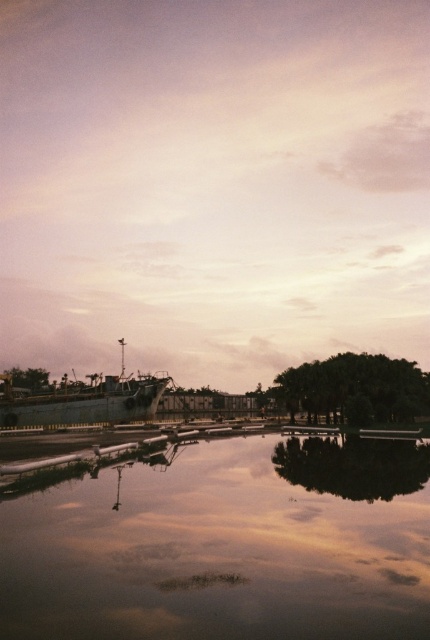
You are a photographer trying to capture the rusty metal ship at center and the smooth reflective water at center in a single shot. Which object should you adjust your camera angle to focus on first if you want to include both in your frame?

You should focus on the rusty metal ship at center first because the smooth reflective water at center is positioned on the right side of it, so adjusting the angle to include both would require starting with the ship and then framing the water to its right.

You are an artist planning to paint the scene. You want to ensure the smooth reflective water at center and the rusty metal ship at center are proportionally accurate. Which object should you paint first if you want to start with the larger one?

The rusty metal ship at center is larger than the smooth reflective water at center, so you should paint the rusty metal ship at center first.